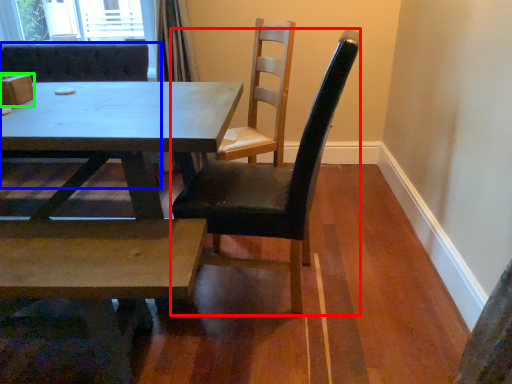
Question: Which object is the closest to the chair (highlighted by a red box)? Choose among these: chair (highlighted by a blue box) or box (highlighted by a green box).

Choices:
 (A) chair
 (B) box

Answer: (B)